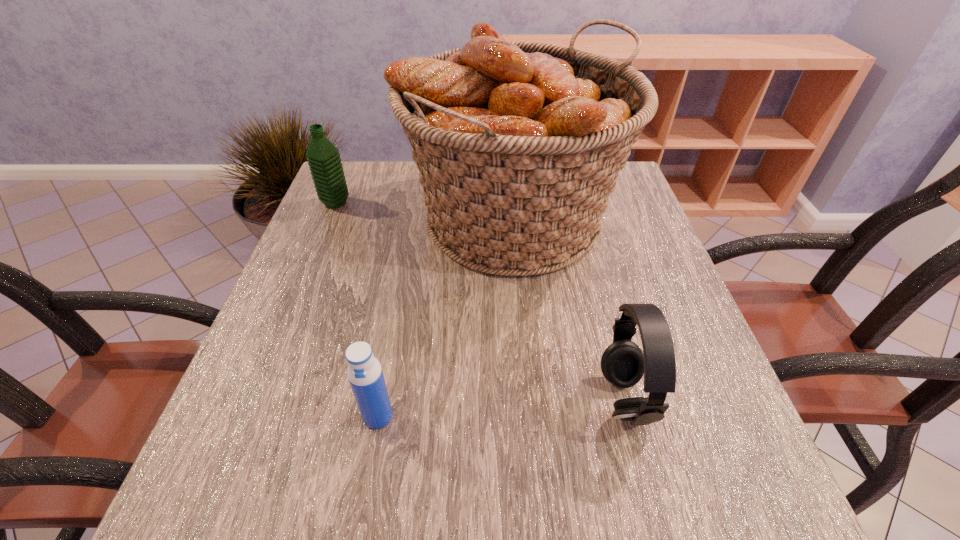
Where is `free spot located 0.280m on the ear cups of the earphone`? The height and width of the screenshot is (540, 960). free spot located 0.280m on the ear cups of the earphone is located at coordinates (x=430, y=399).

Where is `vacant space located on the left of the shorter water bottle`? This screenshot has height=540, width=960. vacant space located on the left of the shorter water bottle is located at coordinates (281, 416).

What are the coordinates of `basket that is at the far edge` in the screenshot? It's located at (518, 144).

Find the location of `water bottle present at the far edge`. water bottle present at the far edge is located at coordinates (323, 158).

Where is `object located in the left edge section of the desktop`? object located in the left edge section of the desktop is located at coordinates (323, 158).

The height and width of the screenshot is (540, 960). I want to click on basket present at the right edge, so click(518, 144).

Locate an element on the screen. The height and width of the screenshot is (540, 960). earphone that is at the right edge is located at coordinates (623, 363).

This screenshot has width=960, height=540. Find the location of `object that is at the far left corner`. object that is at the far left corner is located at coordinates (323, 158).

You are a GUI agent. You are given a task and a screenshot of the screen. Output one action in this format:
    pyautogui.click(x=<x>, y=<y>)
    Task: Click on the object present at the far right corner
    Image resolution: width=960 pixels, height=540 pixels.
    Given the screenshot: What is the action you would take?
    pyautogui.click(x=518, y=144)

Identify the location of free space at the far edge of the desktop. The image size is (960, 540). (402, 161).